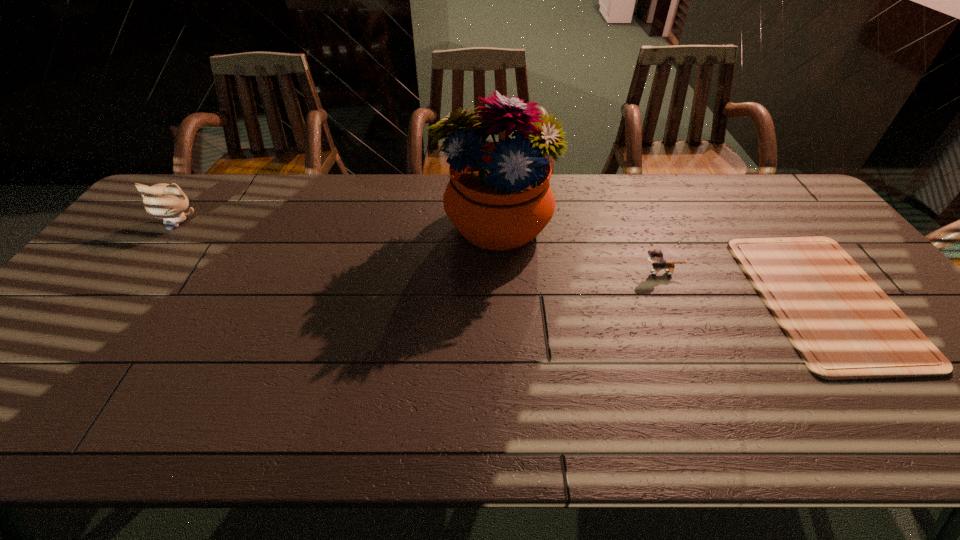
Image resolution: width=960 pixels, height=540 pixels. In order to click on blank area located on the front-facing side of the right kitten in this screenshot , I will do `click(511, 272)`.

Locate an element on the screen. The image size is (960, 540). flower arrangement at the far edge is located at coordinates coord(499,197).

Image resolution: width=960 pixels, height=540 pixels. What are the coordinates of `kitten that is positioned at the far edge` in the screenshot? It's located at (166, 201).

This screenshot has width=960, height=540. Find the location of `object present at the left edge`. object present at the left edge is located at coordinates (166, 201).

The image size is (960, 540). Identify the location of object present at the far left corner. (166, 201).

This screenshot has height=540, width=960. Identify the location of vacant space at the far edge of the desktop. tap(229, 181).

Identify the location of vacant space at the near edge of the desktop. The width and height of the screenshot is (960, 540). (870, 435).

Identify the location of vacant space at the left edge of the desktop. (114, 298).

In the image, there is a desktop. Where is `free region at the right edge`? The height and width of the screenshot is (540, 960). free region at the right edge is located at coordinates (821, 234).

Where is `free spot at the near right corner of the desktop`? This screenshot has height=540, width=960. free spot at the near right corner of the desktop is located at coordinates (934, 408).